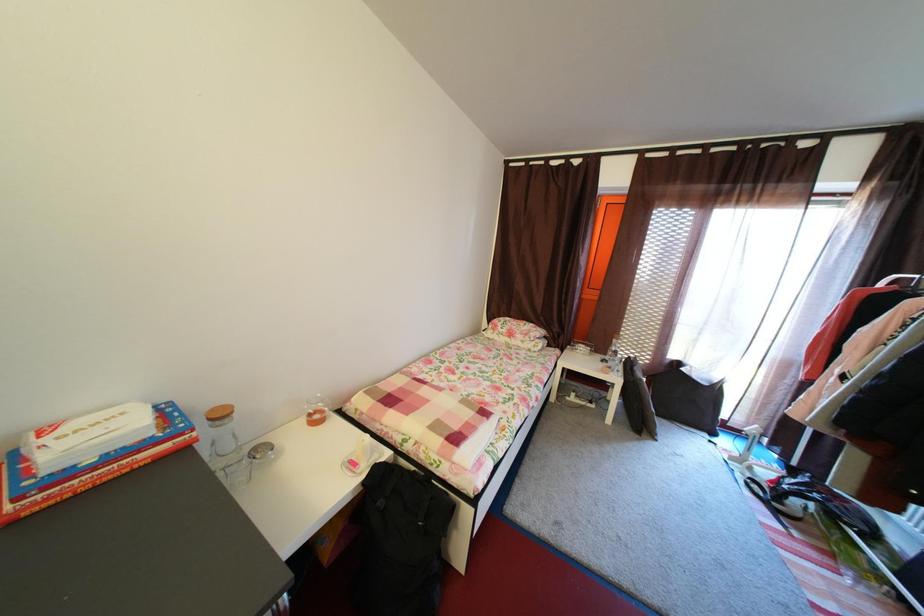
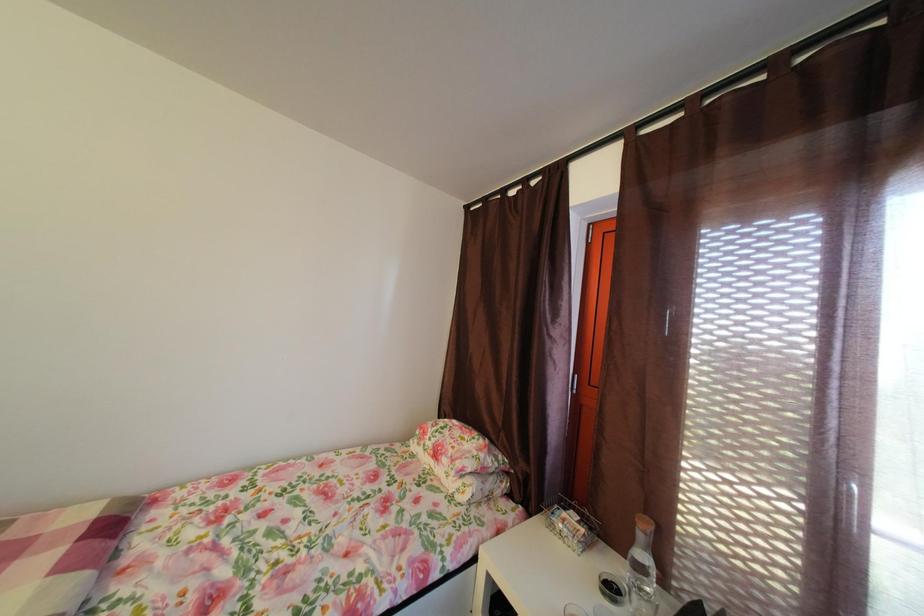
The images are taken continuously from a first-person perspective. In which direction are you moving?

The cameraman walked toward right, forward.